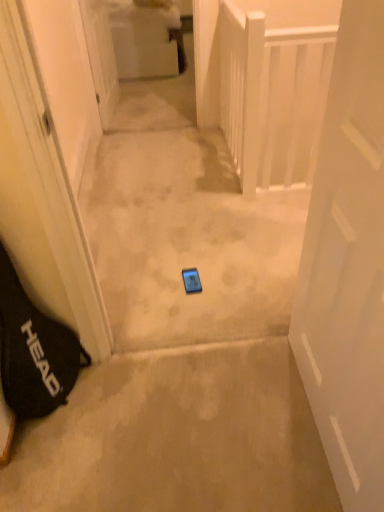
Describe the element at coordinates (34, 351) in the screenshot. I see `black fabric bag at left` at that location.

In order to face white glossy door at upper center, which is counted as the 1th door, starting from the left, should I rotate leftwards or rightwards?

Rotate your view left by about 11.831°.

Describe the element at coordinates (184, 228) in the screenshot. This screenshot has width=384, height=512. I see `blue glossy phone at center` at that location.

Measure the distance between point (216, 154) and camera.

The depth of point (216, 154) is 3.00 meters.

Locate an element on the screen. This screenshot has height=512, width=384. white wooden balustrade at upper right is located at coordinates point(273,96).

The image size is (384, 512). I want to click on black fabric bag at left, so click(34, 351).

Locate an element on the screen. concrete that appears in front of the blue glossy phone at center is located at coordinates (177, 437).

From a real-world perspective, between beige carpet at center and blue glossy phone at center, who is vertically higher?

In real-world perspective, blue glossy phone at center is above.

From the image's perspective, between beige carpet at center and blue glossy phone at center, who is located below?

beige carpet at center.

Is beige carpet at center in contact with blue glossy phone at center?

No, beige carpet at center is not with blue glossy phone at center.

From a real-world perspective, does blue glossy phone at center sit lower than beige carpet at center?

Actually, blue glossy phone at center is physically above beige carpet at center in the real world.

Can you confirm if blue glossy phone at center is positioned to the left of beige carpet at center?

No.

Considering the positions of point (185, 330) and point (254, 341), is point (185, 330) closer or farther from the camera than point (254, 341)?

Point (185, 330) is farther from the camera than point (254, 341).

Based on their sizes in the image, would you say white wooden balustrade at upper right is bigger or smaller than white glossy door at upper center, the second door from the right?

In the image, white wooden balustrade at upper right appears to be smaller than white glossy door at upper center, the second door from the right.

Is white wooden balustrade at upper right placed right next to white glossy door at upper center, the 1th door viewed from the top?

white wooden balustrade at upper right and white glossy door at upper center, the 1th door viewed from the top, are not in contact.

Which of these two, white wooden balustrade at upper right or white glossy door at upper center, the 1th door viewed from the top, is wider?

white wooden balustrade at upper right is wider.

What are the coordinates of `the 1st door above the white wooden balustrade at upper right (from a real-world perspective)` in the screenshot? It's located at (101, 57).

Is white wooden balustrade at upper right to the left of black fabric bag at left from the viewer's perspective?

No, white wooden balustrade at upper right is not to the left of black fabric bag at left.

Which point is more distant from viewer, (262, 106) or (29, 395)?

Positioned behind is point (262, 106).

From a real-world perspective, does white wooden balustrade at upper right sit lower than black fabric bag at left?

No, from a real-world perspective, white wooden balustrade at upper right is not under black fabric bag at left.

Considering the sizes of objects white wooden balustrade at upper right and black fabric bag at left in the image provided, who is taller, white wooden balustrade at upper right or black fabric bag at left?

white wooden balustrade at upper right.

Consider the image. Is white matte door at center, which is the 2th door from back to front, oriented away from white wooden balustrade at upper right?

white matte door at center, which is the 2th door from back to front, is not turned away from white wooden balustrade at upper right.

Who is taller, white matte door at center, the 1th door in the front-to-back sequence, or white wooden balustrade at upper right?

white matte door at center, the 1th door in the front-to-back sequence, is taller.

Is white matte door at center, the 1th door in the front-to-back sequence, not close to white wooden balustrade at upper right?

white matte door at center, the 1th door in the front-to-back sequence, is far away from white wooden balustrade at upper right.

Can you confirm if beige carpet at center is wider than black fabric bag at left?

Correct, the width of beige carpet at center exceeds that of black fabric bag at left.

This screenshot has height=512, width=384. Identify the location of concrete behind the black fabric bag at left. (177, 437).

Is beige carpet at center positioned before black fabric bag at left?

That is False.

Considering the sizes of objects beige carpet at center and black fabric bag at left in the image provided, who is shorter, beige carpet at center or black fabric bag at left?

beige carpet at center is shorter.

Is blue glossy phone at center far away from black fabric bag at left?

Actually, blue glossy phone at center and black fabric bag at left are a little close together.

Is blue glossy phone at center oriented away from black fabric bag at left?

No, black fabric bag at left is not at the back of blue glossy phone at center.

Is point (137, 85) closer or farther from the camera than point (23, 367)?

Clearly, point (137, 85) is more distant from the camera than point (23, 367).

This screenshot has height=512, width=384. In order to click on concrete lying in front of the blue glossy phone at center in this screenshot , I will do `click(177, 437)`.

Where is `concrete lying on the left of blue glossy phone at center`? Image resolution: width=384 pixels, height=512 pixels. concrete lying on the left of blue glossy phone at center is located at coordinates (177, 437).

Looking at the image, which one is located closer to white glossy door at upper center, the second door from the right, white wooden balustrade at upper right or blue glossy phone at center?

blue glossy phone at center is closer to white glossy door at upper center, the second door from the right.

From the image, which object appears to be farther from beige carpet at center, blue glossy phone at center or white wooden balustrade at upper right?

Among the two, white wooden balustrade at upper right is located further to beige carpet at center.

From the image, which object appears to be farther from black fabric bag at left, white wooden balustrade at upper right or white matte door at center, which is the 1th door in right-to-left order?

white wooden balustrade at upper right is further to black fabric bag at left.

Estimate the real-world distances between objects in this image. Which object is closer to black fabric bag at left, blue glossy phone at center or white matte door at center, which is the 1th door in right-to-left order?

Based on the image, blue glossy phone at center appears to be nearer to black fabric bag at left.

Based on their spatial positions, is white wooden balustrade at upper right or beige carpet at center further from blue glossy phone at center?

beige carpet at center is positioned further to the anchor blue glossy phone at center.

Based on their spatial positions, is white wooden balustrade at upper right or white matte door at center, which is the 2th door from back to front, closer to blue glossy phone at center?

Among the two, white wooden balustrade at upper right is located nearer to blue glossy phone at center.

When comparing their distances from white matte door at center, the 2th door when ordered from left to right, does white wooden balustrade at upper right or beige carpet at center seem further?

Among the two, white wooden balustrade at upper right is located further to white matte door at center, the 2th door when ordered from left to right.

Based on their spatial positions, is beige carpet at center or white glossy door at upper center, the 1th door viewed from the top, further from black fabric bag at left?

Among the two, white glossy door at upper center, the 1th door viewed from the top, is located further to black fabric bag at left.

Image resolution: width=384 pixels, height=512 pixels. I want to click on sack between blue glossy phone at center and beige carpet at center in the vertical direction, so click(x=34, y=351).

Find the location of a particular element. The width and height of the screenshot is (384, 512). sack between white wooden balustrade at upper right and beige carpet at center in the vertical direction is located at coordinates click(34, 351).

Where is `path between white wooden balustrade at upper right and beige carpet at center in the up-down direction`? This screenshot has height=512, width=384. path between white wooden balustrade at upper right and beige carpet at center in the up-down direction is located at coordinates (184, 228).

Identify the location of balustrade between white matte door at center, the 1th door in the front-to-back sequence, and white glossy door at upper center, placed as the 2th door when sorted from front to back, from front to back. (273, 96).